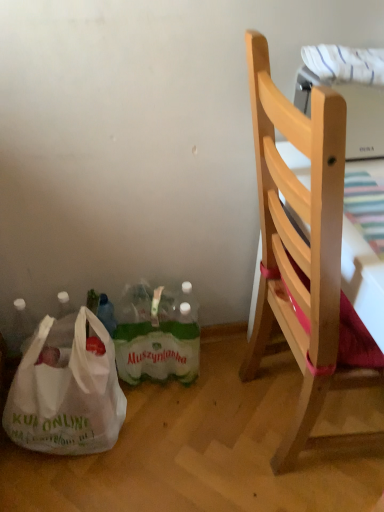
Question: Is white plastic bag at lower left in front of or behind natural wood chair at right in the image?

Choices:
 (A) behind
 (B) front

Answer: (A)

Question: Considering the relative positions of white plastic bag at lower left and natural wood chair at right in the image provided, is white plastic bag at lower left to the left or to the right of natural wood chair at right?

Choices:
 (A) left
 (B) right

Answer: (A)

Question: Estimate the real-world distances between objects in this image. Which object is closer to the natural wood chair at right?

Choices:
 (A) white plastic bag at lower left
 (B) green plastic bottles at lower center

Answer: (B)

Question: Which is farther from the natural wood chair at right?

Choices:
 (A) white plastic bag at lower left
 (B) green plastic bottles at lower center

Answer: (A)